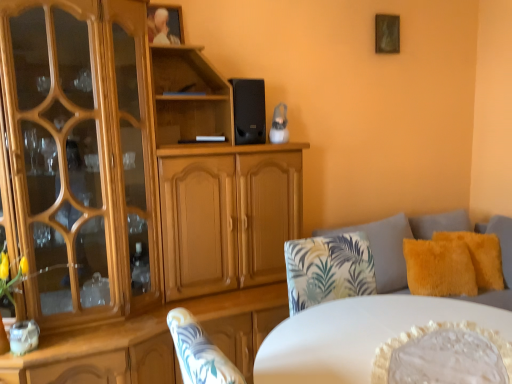
Question: Is black matte speaker at upper center to the left or to the right of white glossy table at center in the image?

Choices:
 (A) left
 (B) right

Answer: (A)

Question: From the image's perspective, relative to white glossy table at center, is black matte speaker at upper center above or below?

Choices:
 (A) above
 (B) below

Answer: (A)

Question: Which object is positioned closest to the fluffy yellow cushions at right?

Choices:
 (A) wooden picture frame at upper center, which is counted as the second picture frame, starting from the right
 (B) light brown wood cabinet at center
 (C) fluffy yellow pillow at right, which ranks as the first pillow in right-to-left order
 (D) fuzzy yellow pillow at right, marked as the 2th pillow in a right-to-left arrangement
 (E) wooden picture frame at upper right, the 1th picture frame from the back

Answer: (C)

Question: Estimate the real-world distances between objects in this image. Which object is closer to the wooden picture frame at upper right, which is the 2th picture frame in left-to-right order?

Choices:
 (A) wooden picture frame at upper center, the 1th picture frame when ordered from left to right
 (B) light brown wood cabinet at center
 (C) white glossy table at center
 (D) fluffy yellow pillow at right, which ranks as the first pillow in right-to-left order
 (E) black matte speaker at upper center

Answer: (E)